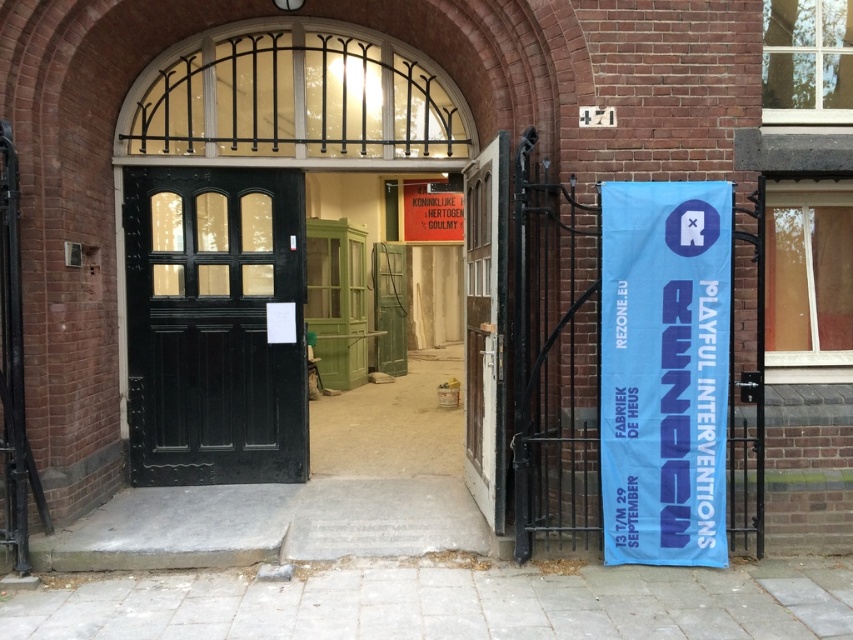
Between matte black door at center and wooden door at center, which one has less height?

Standing shorter between the two is matte black door at center.

Does matte black door at center lie in front of wooden door at center?

That is False.

Locate an element on the screen. Image resolution: width=853 pixels, height=640 pixels. matte black door at center is located at coordinates (213, 324).

Identify the location of matte black door at center. (213, 324).

Is blue fabric banner at right below wooden door at center?

Correct, blue fabric banner at right is located below wooden door at center.

Who is positioned more to the right, blue fabric banner at right or wooden door at center?

blue fabric banner at right is more to the right.

In order to click on blue fabric banner at right in this screenshot , I will do `click(664, 371)`.

Which is in front, point (190, 364) or point (724, 545)?

Point (724, 545) is in front.

Does matte black door at center appear on the left side of blue fabric banner at right?

Correct, you'll find matte black door at center to the left of blue fabric banner at right.

Who is more distant from viewer, (173, 228) or (694, 400)?

Positioned behind is point (173, 228).

Find the location of a particular element. matte black door at center is located at coordinates (213, 324).